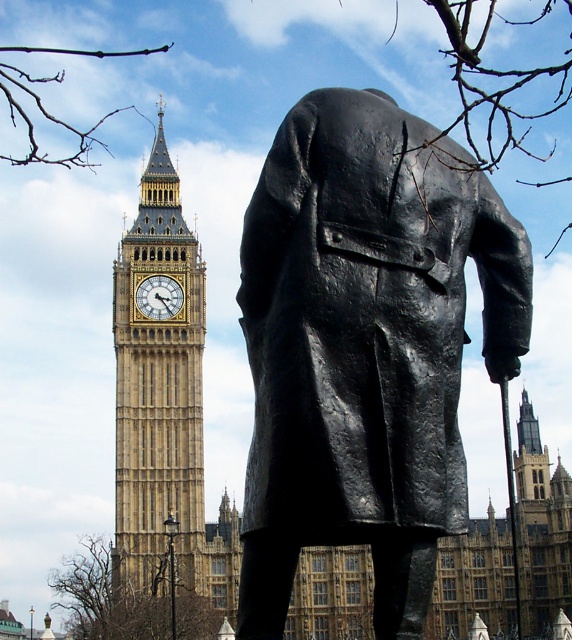
Question: Which object appears farthest from the camera in this image?

Choices:
 (A) gold-gilded clock at center
 (B) golden stone clock tower at left
 (C) black polished statue at center

Answer: (A)

Question: Can you confirm if golden stone clock tower at left is bigger than gold-gilded clock at center?

Choices:
 (A) yes
 (B) no

Answer: (A)

Question: Can you confirm if black polished statue at center is positioned to the right of gold-gilded clock at center?

Choices:
 (A) no
 (B) yes

Answer: (B)

Question: Observing the image, what is the correct spatial positioning of golden stone clock tower at left in reference to gold-gilded clock at center?

Choices:
 (A) left
 (B) right

Answer: (A)

Question: Considering the real-world distances, which object is farthest from the black polished statue at center?

Choices:
 (A) golden stone clock tower at left
 (B) gold-gilded clock at center

Answer: (B)

Question: Estimate the real-world distances between objects in this image. Which object is farther from the black polished statue at center?

Choices:
 (A) gold-gilded clock at center
 (B) golden stone clock tower at left

Answer: (A)